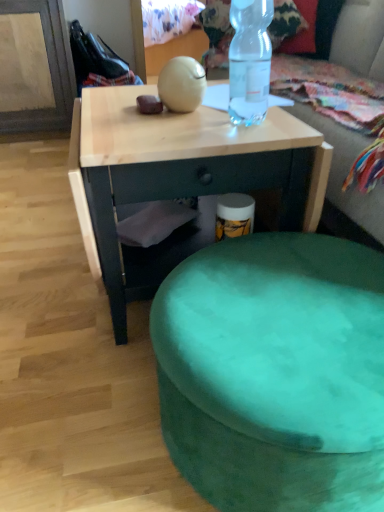
You are a GUI agent. You are given a task and a screenshot of the screen. Output one action in this format:
    pyautogui.click(x=<x>, y=<y>)
    Task: Click on the vacant area on top of velvet green ottoman at lower center (from a real-world perspective)
    The width and height of the screenshot is (384, 512).
    Given the screenshot: What is the action you would take?
    288,300